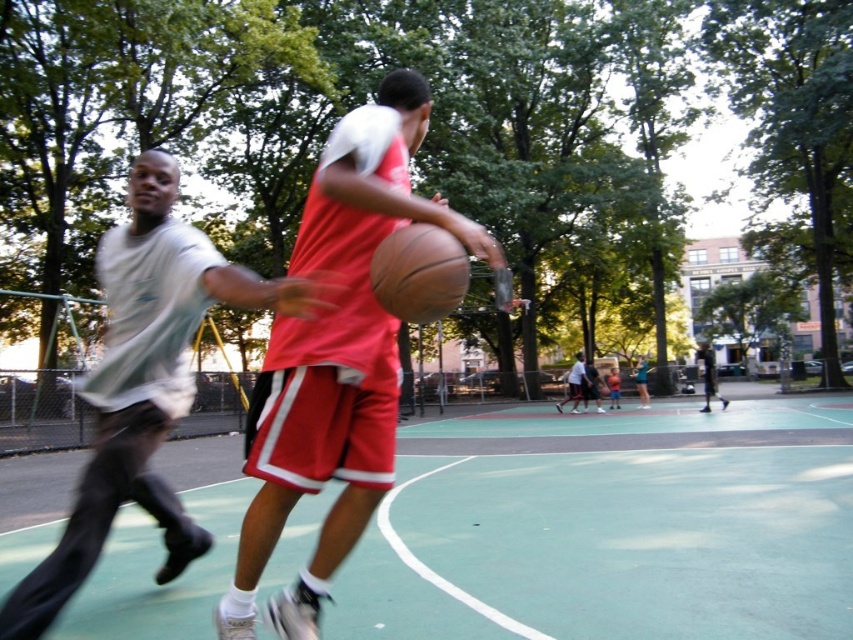
Question: In this image, where is matte red shorts at center located relative to white cotton t-shirt at left?

Choices:
 (A) above
 (B) below

Answer: (B)

Question: Which object is farther from the camera taking this photo?

Choices:
 (A) white cotton t-shirt at left
 (B) rubber textured basketball at center
 (C) matte black basketball at center
 (D) matte red shorts at center

Answer: (C)

Question: Can you confirm if white cotton t-shirt at left is positioned below matte black basketball at center?

Choices:
 (A) no
 (B) yes

Answer: (A)

Question: Can you confirm if matte red shorts at center is positioned to the left of rubber textured basketball at center?

Choices:
 (A) yes
 (B) no

Answer: (A)

Question: Which object is farther from the camera taking this photo?

Choices:
 (A) matte red shorts at center
 (B) rubber textured basketball at center

Answer: (A)

Question: Based on their relative distances, which object is farther from the matte black basketball at center?

Choices:
 (A) white cotton t-shirt at left
 (B) green rubber basketball court at center
 (C) matte red shorts at center

Answer: (C)